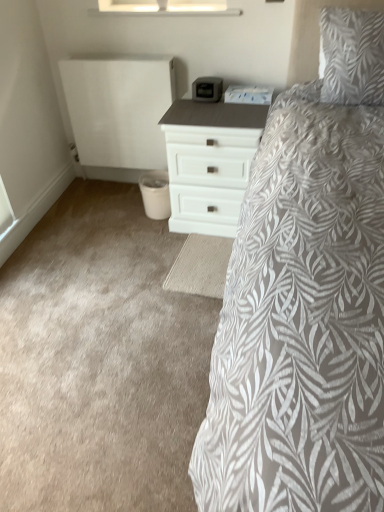
Question: From a real-world perspective, is white matte chest of drawers at center physically above white leaf-patterned pillow at upper right?

Choices:
 (A) no
 (B) yes

Answer: (A)

Question: Would you say white matte chest of drawers at center contains white leaf-patterned pillow at upper right?

Choices:
 (A) no
 (B) yes

Answer: (A)

Question: Is white matte chest of drawers at center with white leaf-patterned pillow at upper right?

Choices:
 (A) no
 (B) yes

Answer: (A)

Question: Does white matte chest of drawers at center lie in front of white leaf-patterned pillow at upper right?

Choices:
 (A) yes
 (B) no

Answer: (B)

Question: Is white leaf-patterned pillow at upper right at the back of white matte chest of drawers at center?

Choices:
 (A) yes
 (B) no

Answer: (B)

Question: In terms of width, does transparent glass window at upper center look wider or thinner when compared to white leaf-patterned pillow at upper right?

Choices:
 (A) thin
 (B) wide

Answer: (A)

Question: Considering the positions of transparent glass window at upper center and white leaf-patterned pillow at upper right in the image, is transparent glass window at upper center taller or shorter than white leaf-patterned pillow at upper right?

Choices:
 (A) short
 (B) tall

Answer: (A)

Question: Considering the relative positions of transparent glass window at upper center and white leaf-patterned pillow at upper right in the image provided, is transparent glass window at upper center to the left or to the right of white leaf-patterned pillow at upper right?

Choices:
 (A) left
 (B) right

Answer: (A)

Question: In the image, is transparent glass window at upper center positioned in front of or behind white leaf-patterned pillow at upper right?

Choices:
 (A) behind
 (B) front

Answer: (A)

Question: Looking at the image, does white matte chest of drawers at center seem bigger or smaller compared to transparent glass window at upper center?

Choices:
 (A) big
 (B) small

Answer: (A)

Question: In terms of width, does white matte chest of drawers at center look wider or thinner when compared to transparent glass window at upper center?

Choices:
 (A) wide
 (B) thin

Answer: (A)

Question: From the image's perspective, is white matte chest of drawers at center positioned above or below transparent glass window at upper center?

Choices:
 (A) below
 (B) above

Answer: (A)

Question: From a real-world perspective, is white matte chest of drawers at center physically located above or below transparent glass window at upper center?

Choices:
 (A) above
 (B) below

Answer: (B)

Question: In the image, is white leaf-patterned pillow at upper right positioned in front of or behind white matte chest of drawers at center?

Choices:
 (A) front
 (B) behind

Answer: (A)

Question: Visually, is white leaf-patterned pillow at upper right positioned to the left or to the right of white matte chest of drawers at center?

Choices:
 (A) left
 (B) right

Answer: (B)